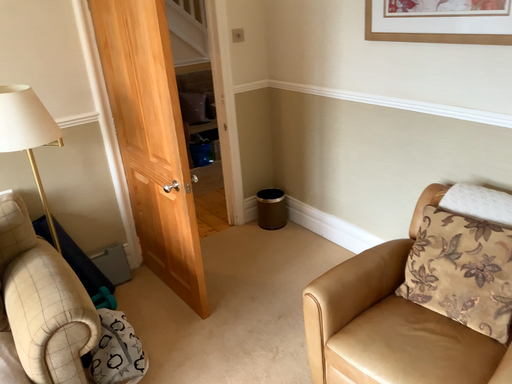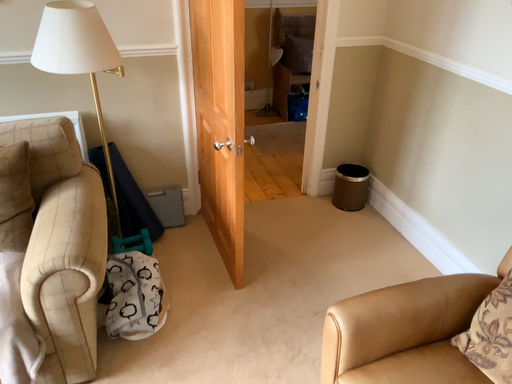
Question: Which way did the camera rotate in the video?

Choices:
 (A) rotated left
 (B) rotated right

Answer: (A)